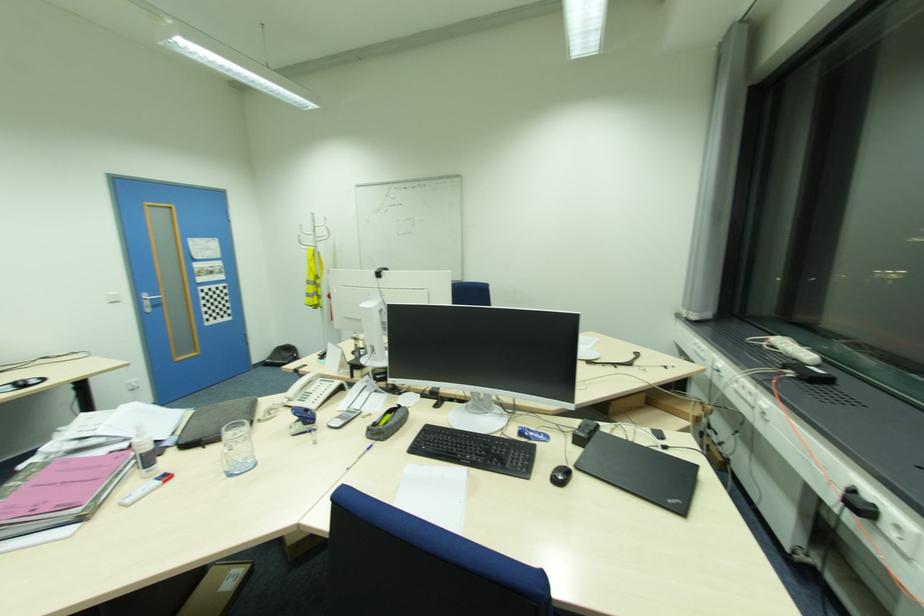
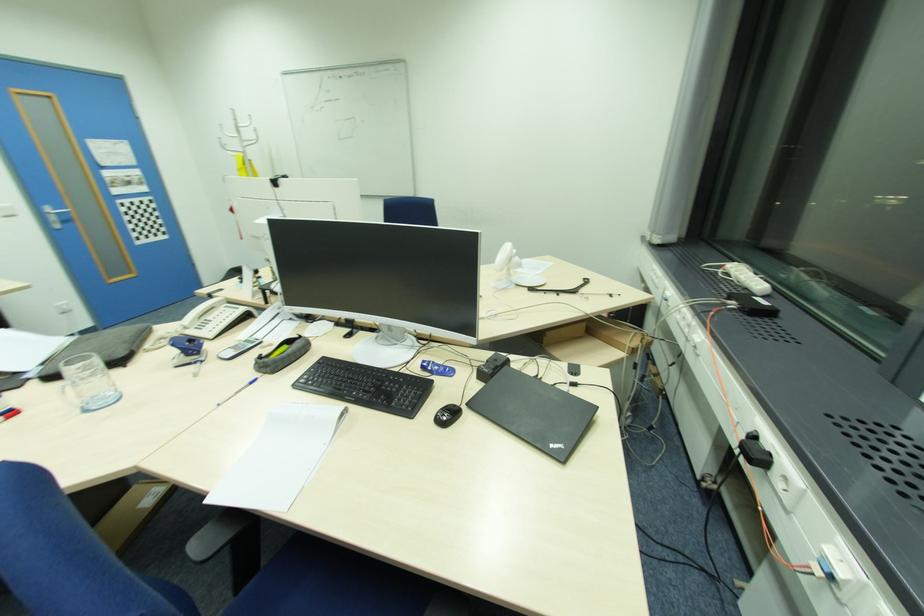
In the second image, find the point that corresponds to [148,300] in the first image.

(54, 213)